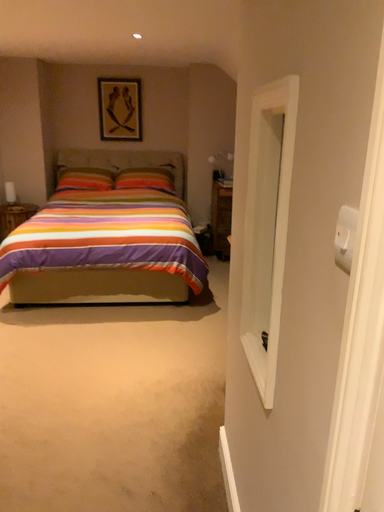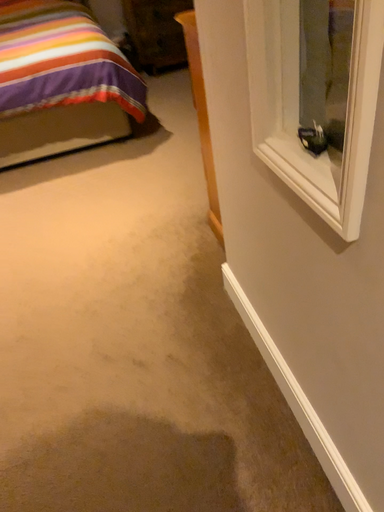
Question: How did the camera likely rotate when shooting the video?

Choices:
 (A) rotated downward
 (B) rotated upward

Answer: (A)